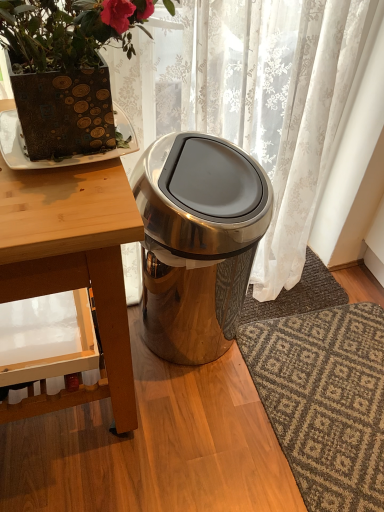
I want to click on free point above brown textured rug at lower right, placed as the 2th doormat when sorted from top to bottom (from a real-world perspective), so click(332, 378).